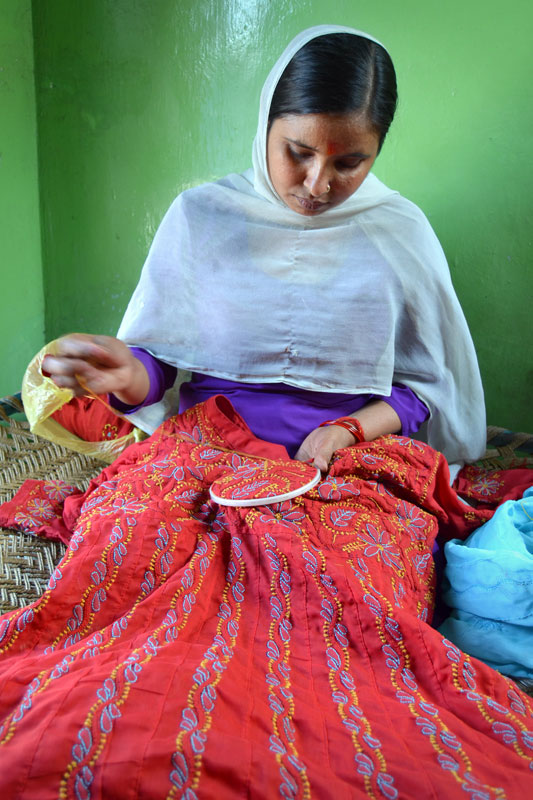
Where is `mattress`? This screenshot has width=533, height=800. mattress is located at coordinates (27, 566).